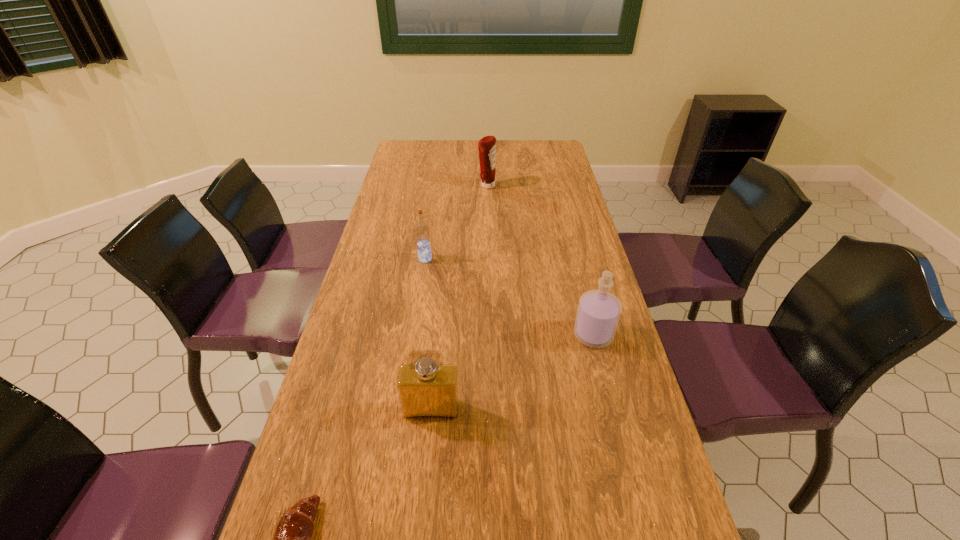
Find the location of `the right perfume`. the right perfume is located at coordinates (598, 313).

I want to click on the rightmost object, so click(x=598, y=313).

I want to click on condiment, so click(487, 145).

Image resolution: width=960 pixels, height=540 pixels. I want to click on the fourth object from left to right, so click(x=487, y=145).

Locate an element on the screen. This screenshot has width=960, height=540. the fourth nearest object is located at coordinates (422, 232).

Locate an element on the screen. This screenshot has width=960, height=540. the fourth farthest object is located at coordinates (427, 389).

Locate an element on the screen. This screenshot has height=540, width=960. the shorter perfume is located at coordinates (427, 389).

The image size is (960, 540). What are the coordinates of `vacant space located 0.160m on the back of the right perfume` in the screenshot? It's located at (580, 282).

Identify the location of blank area located 0.110m on the left of the condiment. (450, 186).

You are a GUI agent. You are given a task and a screenshot of the screen. Output one action in this format:
    pyautogui.click(x=<x>, y=<y>)
    Task: Click on the free space located on the left of the second farthest object
    Image resolution: width=960 pixels, height=540 pixels.
    Given the screenshot: What is the action you would take?
    pyautogui.click(x=380, y=259)